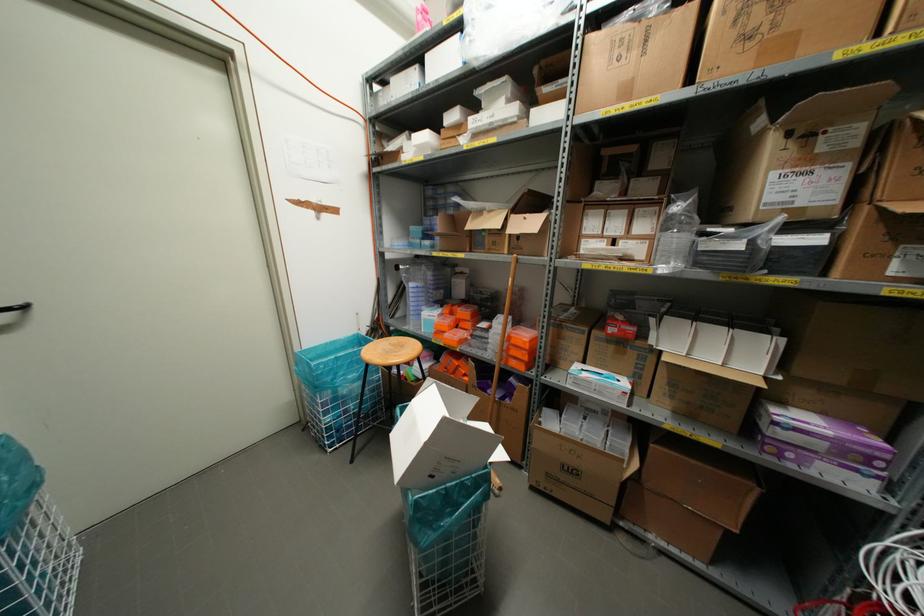
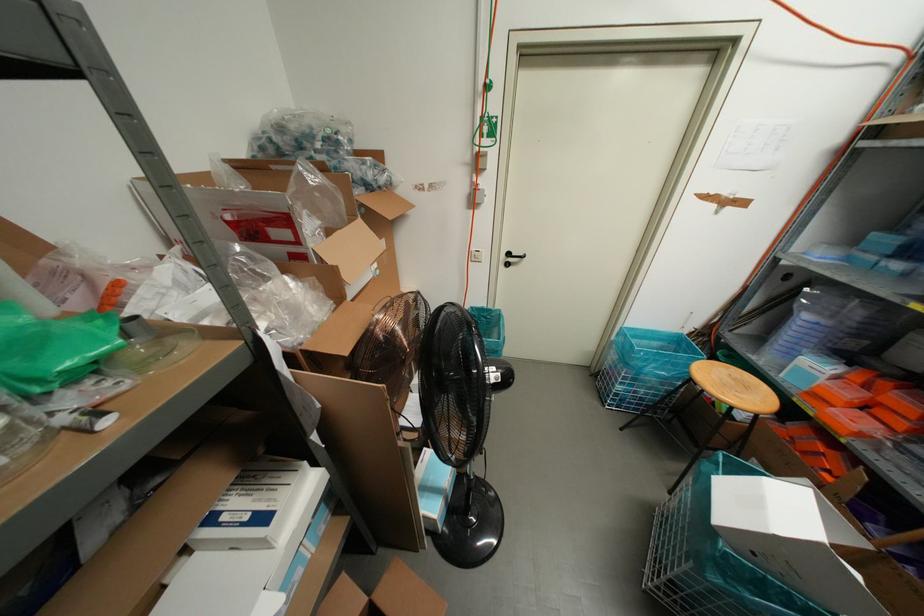
Looking at this image, how did the camera likely rotate?

The rotation direction of the camera is left-down.